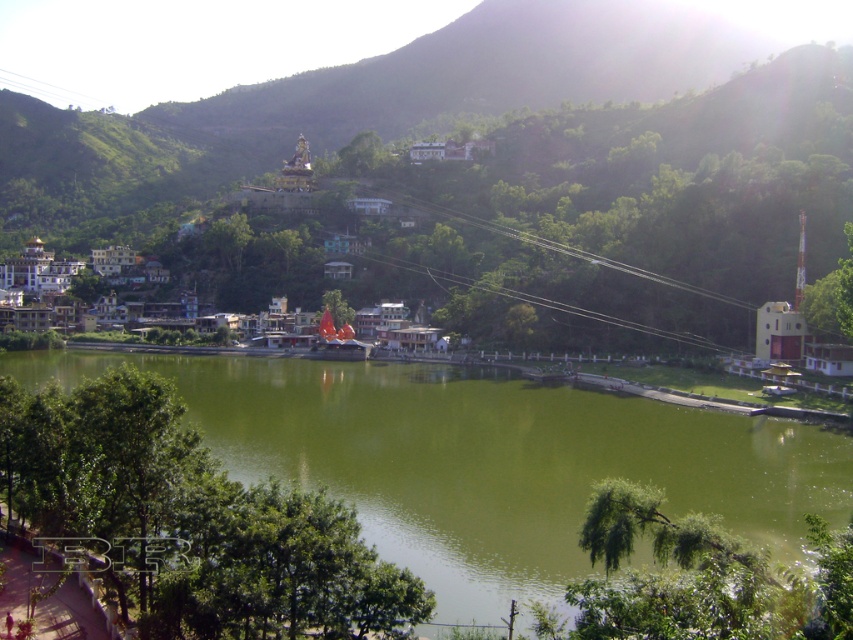
Question: Can you confirm if green water at center is wider than white stucco buildings at center?

Choices:
 (A) yes
 (B) no

Answer: (A)

Question: Can you confirm if green water at center is positioned below white stucco buildings at center?

Choices:
 (A) yes
 (B) no

Answer: (A)

Question: Which of the following is the closest to the observer?

Choices:
 (A) green water at center
 (B) white stucco buildings at center

Answer: (A)

Question: Which object appears farthest from the camera in this image?

Choices:
 (A) green water at center
 (B) white stucco buildings at center

Answer: (B)

Question: Is green water at center closer to camera compared to white stucco buildings at center?

Choices:
 (A) no
 (B) yes

Answer: (B)